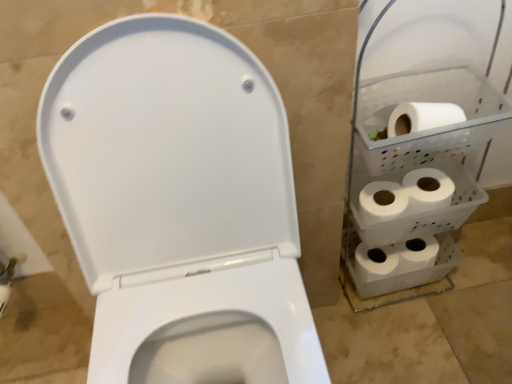
Identify the location of vacant area to the right of white plastic shelf at right. (477, 289).